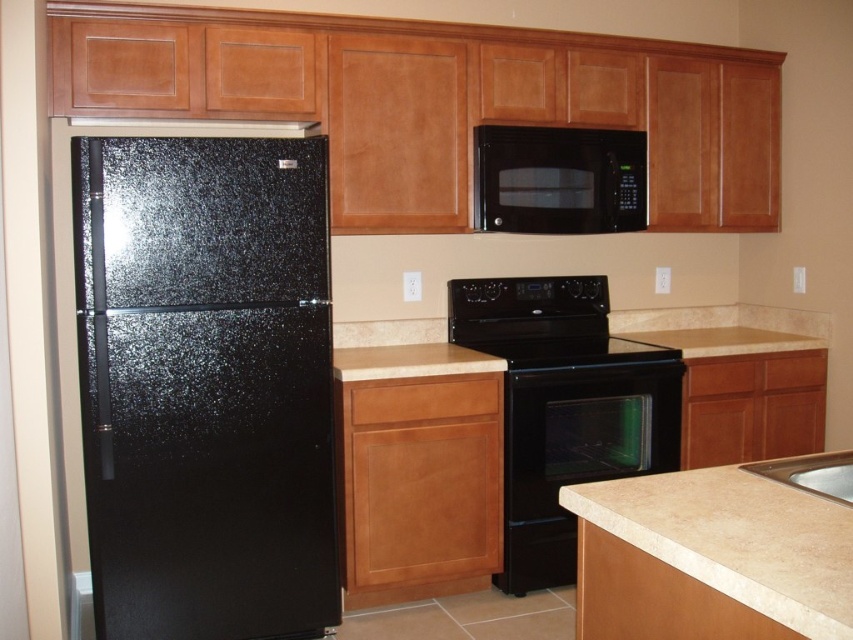
Question: Which point is closer to the camera?

Choices:
 (A) black glossy exhaust hood at upper center
 (B) white marble sink at lower right

Answer: (B)

Question: Can you confirm if black speckled refrigerator at left is positioned below beige laminate countertop at lower right?

Choices:
 (A) yes
 (B) no

Answer: (B)

Question: Is beige laminate countertop at lower right wider than black glass oven at center?

Choices:
 (A) yes
 (B) no

Answer: (B)

Question: Which is nearer to the black matte microwave at upper center?

Choices:
 (A) black glossy exhaust hood at upper center
 (B) black glass oven at center
 (C) white marble sink at lower right

Answer: (B)

Question: Does black matte microwave at upper center have a larger size compared to white marble sink at lower right?

Choices:
 (A) yes
 (B) no

Answer: (A)

Question: Which of the following is the closest to the observer?

Choices:
 (A) (270, 124)
 (B) (624, 422)

Answer: (A)